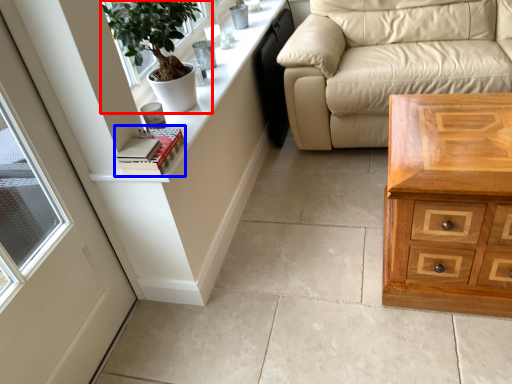
Question: Which object is further to the camera taking this photo, houseplant (highlighted by a red box) or book (highlighted by a blue box)?

Choices:
 (A) houseplant
 (B) book

Answer: (A)